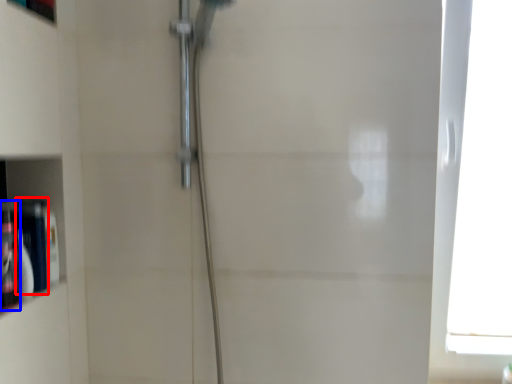
Question: Which of the following is the farthest to the observer, toiletry (highlighted by a red box) or toiletry (highlighted by a blue box)?

Choices:
 (A) toiletry
 (B) toiletry

Answer: (A)